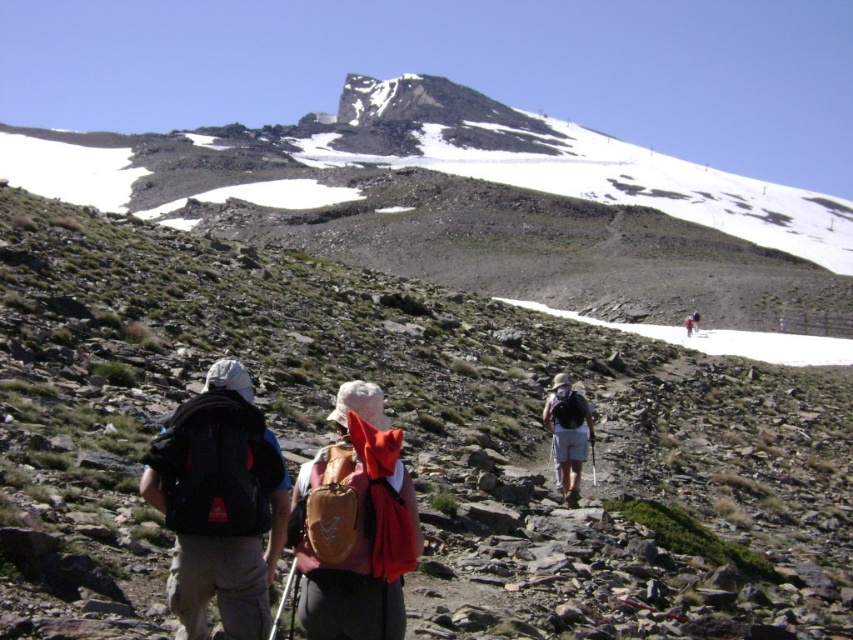
Question: Can you confirm if black matte backpack at left is bigger than matte orange backpack at center?

Choices:
 (A) yes
 (B) no

Answer: (B)

Question: Among these objects, which one is farthest from the camera?

Choices:
 (A) black matte backpack at left
 (B) snowy rock at upper center
 (C) brown fabric backpack at center
 (D) matte orange backpack at center

Answer: (B)

Question: Which of the following is the closest to the observer?

Choices:
 (A) (566, 387)
 (B) (339, 595)
 (C) (463, 136)

Answer: (B)

Question: Which point appears closest to the camera in this image?

Choices:
 (A) (370, 593)
 (B) (577, 394)
 (C) (91, 180)
 (D) (265, 593)

Answer: (A)

Question: Does black matte backpack at left have a lesser width compared to brown fabric backpack at center?

Choices:
 (A) no
 (B) yes

Answer: (B)

Question: Is black matte backpack at left to the right of brown fabric backpack at center from the viewer's perspective?

Choices:
 (A) yes
 (B) no

Answer: (B)